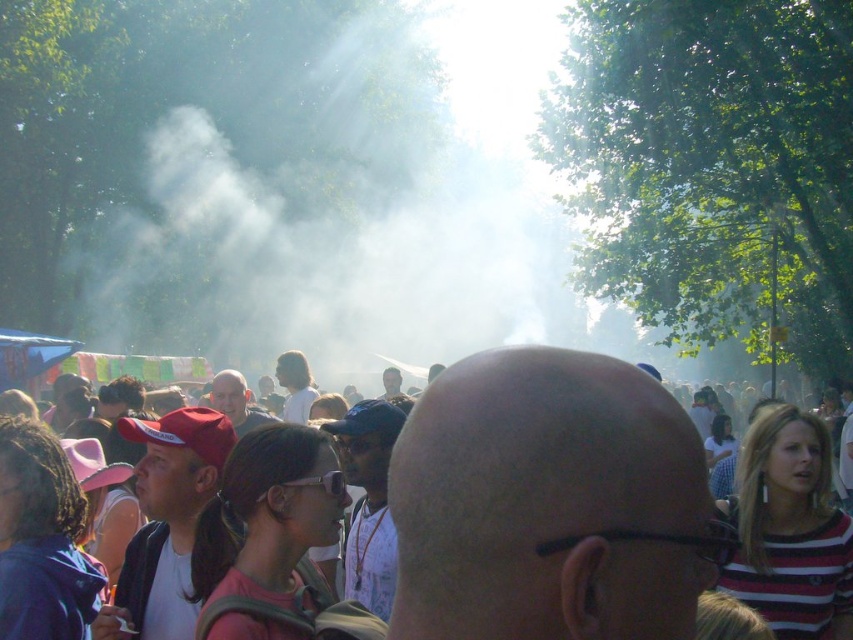
You are standing at the camera position and want to reach the point marked as point (x=260, y=81). If your walking speed is 3 feet per second, how many seconds will it take you to reach that point?

The distance between point (x=260, y=81) and the camera is 126.83 feet. At a walking speed of 3 feet per second, it will take approximately 42.28 seconds to reach the point.